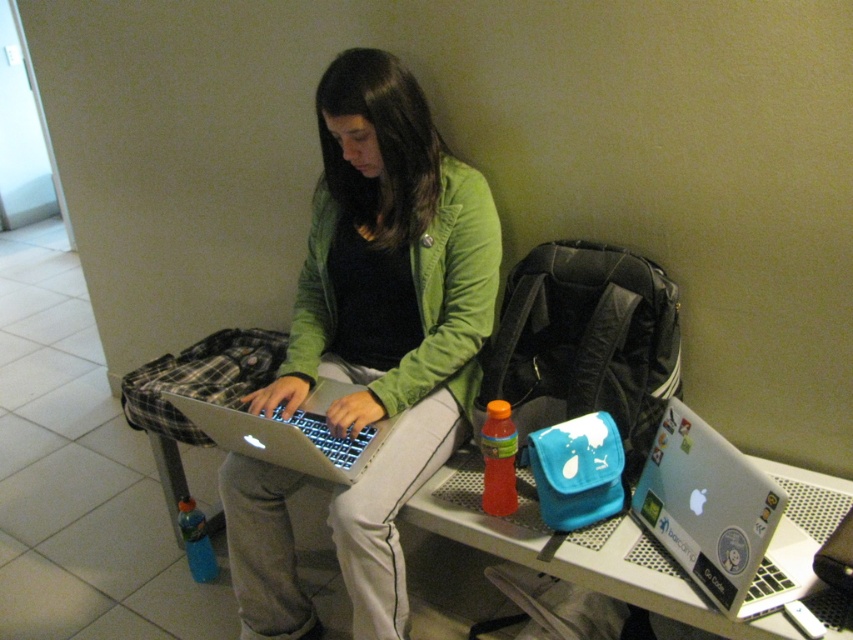
Question: Can you confirm if green matte jacket at center is positioned below metallic silver table at lower center?

Choices:
 (A) no
 (B) yes

Answer: (A)

Question: Which point is farther to the camera?

Choices:
 (A) silver metallic laptop at lower right
 (B) silver metallic laptop at center
 (C) metallic silver table at lower center
 (D) green matte jacket at center

Answer: (D)

Question: Does green matte jacket at center have a larger size compared to silver metallic laptop at center?

Choices:
 (A) no
 (B) yes

Answer: (B)

Question: Which of the following is the closest to the observer?

Choices:
 (A) silver metallic laptop at center
 (B) green matte jacket at center

Answer: (A)

Question: Can you confirm if green matte jacket at center is positioned to the right of silver metallic laptop at lower right?

Choices:
 (A) yes
 (B) no

Answer: (B)

Question: Considering the real-world distances, which object is farthest from the silver metallic laptop at lower right?

Choices:
 (A) green matte jacket at center
 (B) silver metallic laptop at center

Answer: (B)